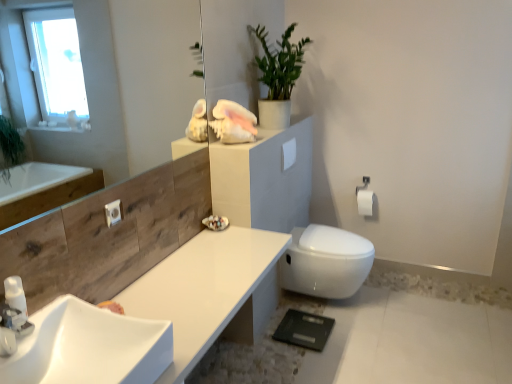
Question: From the image's perspective, relative to white matte toilet paper at right, the second toilet paper positioned from the left, is green matte plant at upper center above or below?

Choices:
 (A) below
 (B) above

Answer: (B)

Question: From a real-world perspective, is green matte plant at upper center positioned above or below white matte toilet paper at right, marked as the 1th toilet paper in a right-to-left arrangement?

Choices:
 (A) above
 (B) below

Answer: (A)

Question: Estimate the real-world distances between objects in this image. Which object is farther from the white glossy bidet at lower right?

Choices:
 (A) green matte plant at upper center
 (B) white glossy counter top at center
 (C) white glossy soap dispenser at lower left
 (D) white glossy tap at lower left
 (E) white matte toilet paper at upper right, the first toilet paper when ordered from top to bottom

Answer: (D)

Question: Estimate the real-world distances between objects in this image. Which object is farther from the transparent glass mirror at upper left?

Choices:
 (A) white glossy tap at lower left
 (B) white glossy soap dispenser at lower left
 (C) white matte toilet paper at upper right, which is counted as the 2th toilet paper, starting from the bottom
 (D) white glossy sink at lower left
 (E) white glossy counter top at center

Answer: (A)